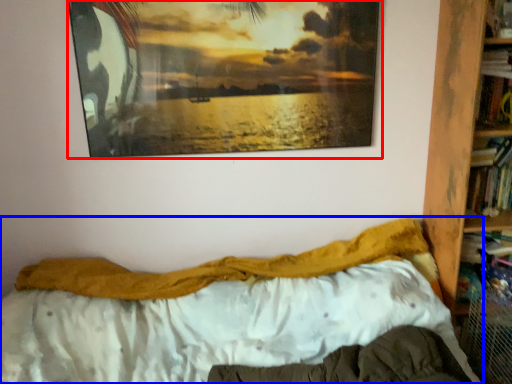
Question: Among these objects, which one is farthest to the camera, picture frame (highlighted by a red box) or bed (highlighted by a blue box)?

Choices:
 (A) picture frame
 (B) bed

Answer: (A)